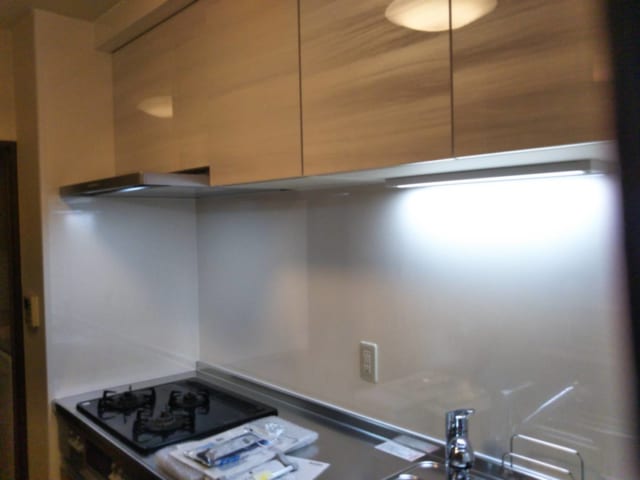
This screenshot has height=480, width=640. I want to click on burner 1, so click(166, 413).